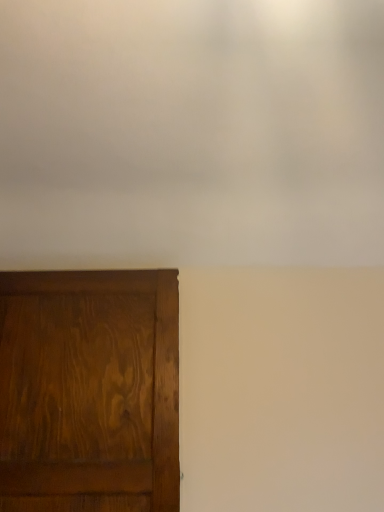
The height and width of the screenshot is (512, 384). What do you see at coordinates (89, 391) in the screenshot?
I see `polished wood door at lower left` at bounding box center [89, 391].

Image resolution: width=384 pixels, height=512 pixels. Identify the location of polished wood door at lower left. (89, 391).

Where is `polished wood door at lower left`? polished wood door at lower left is located at coordinates (89, 391).